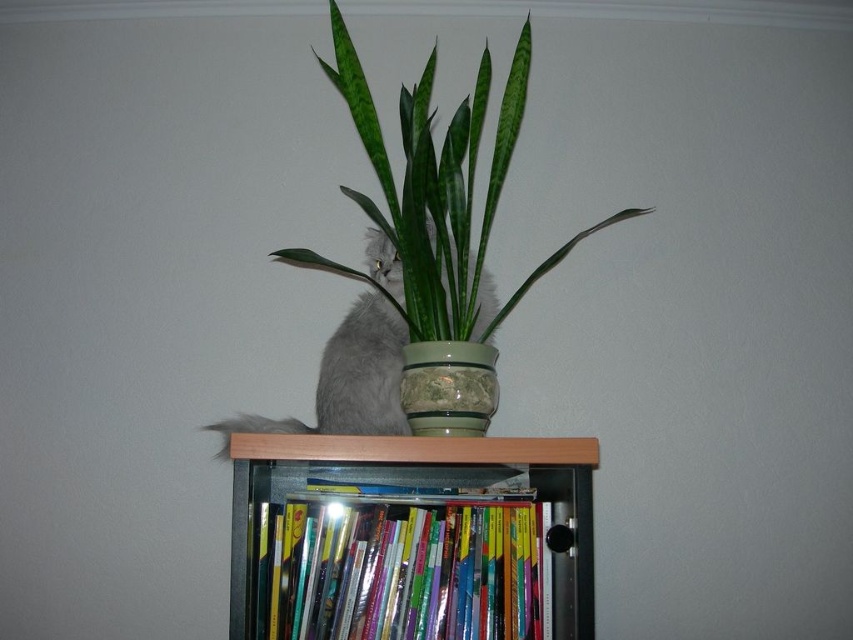
At what (x,y) coordinates should I click in order to perform the action: click on green glossy pot at upper center. Please return your answer as a coordinate pair (x, y). This screenshot has width=853, height=640. Looking at the image, I should click on (428, 186).

Does green glossy pot at upper center appear on the left side of translucent plastic bookcase at center?

Incorrect, green glossy pot at upper center is not on the left side of translucent plastic bookcase at center.

I want to click on green glossy pot at upper center, so click(x=428, y=186).

Which is above, green glossy pot at upper center or fluffy gray cat at center?

green glossy pot at upper center

Measure the distance between point (433, 45) and camera.

Point (433, 45) is 5.05 feet away from camera.

Image resolution: width=853 pixels, height=640 pixels. Identify the location of green glossy pot at upper center. (428, 186).

Is point (573, 572) closer to viewer compared to point (347, 387)?

That is True.

Can you confirm if translucent plastic bookcase at center is smaller than fluffy gray cat at center?

Yes.

This screenshot has width=853, height=640. What do you see at coordinates (410, 465) in the screenshot?
I see `translucent plastic bookcase at center` at bounding box center [410, 465].

Locate an element on the screen. translucent plastic bookcase at center is located at coordinates (410, 465).